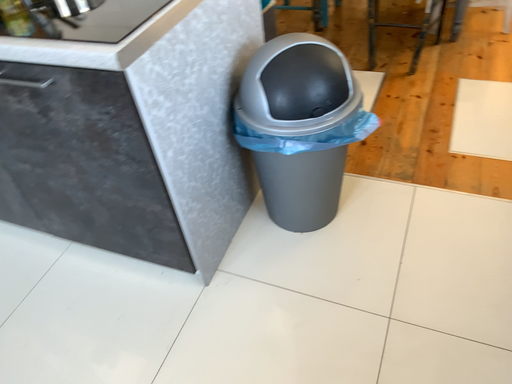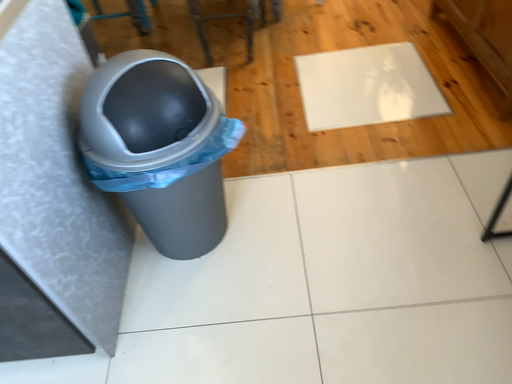
Question: How did the camera likely rotate when shooting the video?

Choices:
 (A) rotated right
 (B) rotated left

Answer: (A)